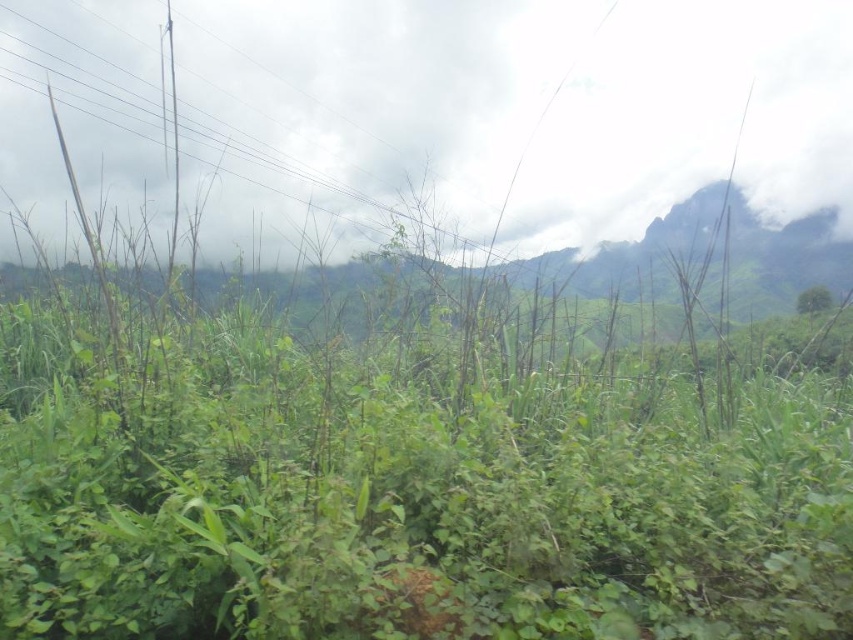
Based on the photo, between white fluffy cloud at upper center and green leafy tree at center, which one appears on the left side from the viewer's perspective?

Positioned to the left is white fluffy cloud at upper center.

This screenshot has height=640, width=853. Describe the element at coordinates (502, 116) in the screenshot. I see `white fluffy cloud at upper center` at that location.

Image resolution: width=853 pixels, height=640 pixels. Identify the location of white fluffy cloud at upper center. (502, 116).